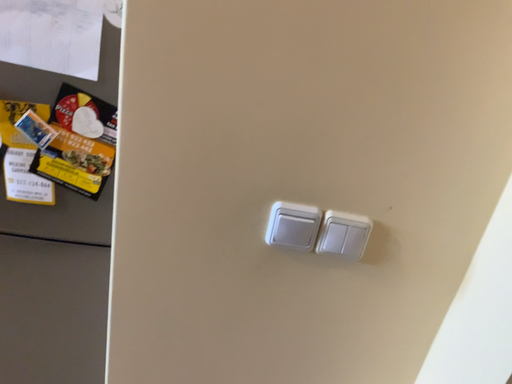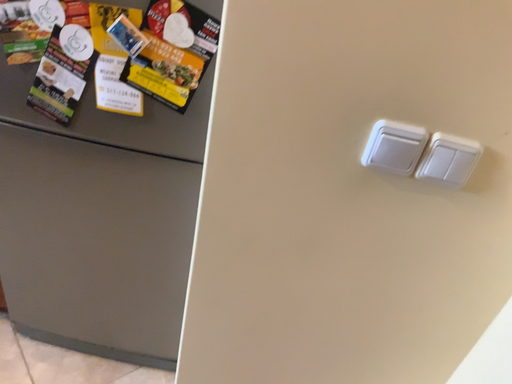
Question: Which way did the camera rotate in the video?

Choices:
 (A) rotated right
 (B) rotated left

Answer: (B)